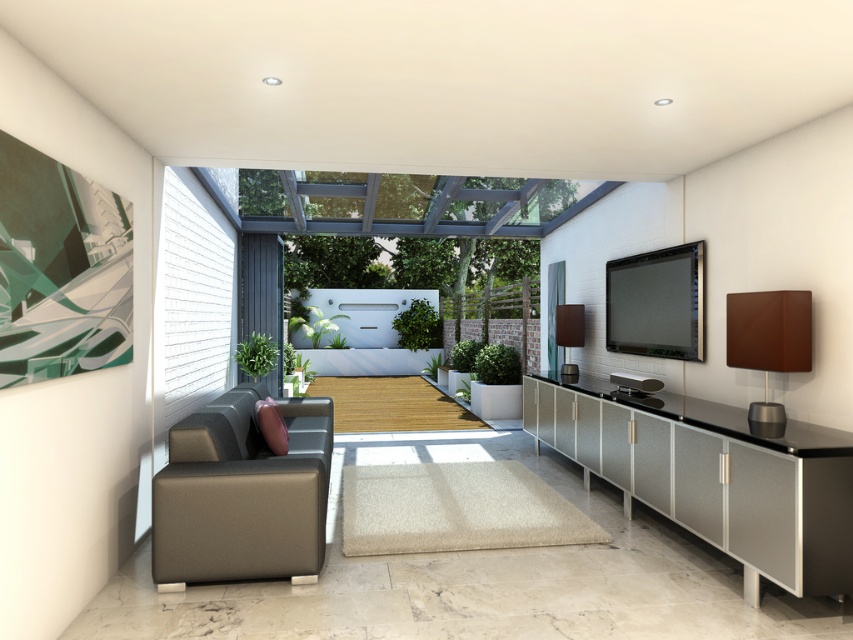
Between point (587, 449) and point (314, 474), which one is positioned in front?

Point (314, 474) is more forward.

How far apart are metallic textured cabinet at lower right and matte brown leather couch at lower left?

They are 10.67 feet apart.

Where is `metallic textured cabinet at lower right`? The width and height of the screenshot is (853, 640). metallic textured cabinet at lower right is located at coordinates (712, 476).